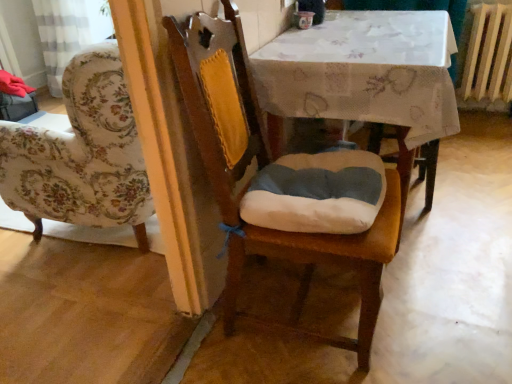
Measure the distance between wooden radiator at right and camera.

wooden radiator at right and camera are 8.00 feet apart.

The width and height of the screenshot is (512, 384). I want to click on white fabric table at center, so click(x=364, y=72).

Measure the distance between wooden radiator at right and white fabric table at center.

wooden radiator at right is 4.15 feet from white fabric table at center.

Considering the relative positions of wooden radiator at right and white fabric table at center in the image provided, is wooden radiator at right to the right of white fabric table at center from the viewer's perspective?

Yes, wooden radiator at right is to the right of white fabric table at center.

From a real-world perspective, is wooden radiator at right below white fabric table at center?

No.

How different are the orientations of wooden radiator at right and white fabric table at center in degrees?

They differ by 89.4 degrees in their facing directions.

Based on the photo, does wooden chair at center have a lesser width compared to wooden radiator at right?

In fact, wooden chair at center might be wider than wooden radiator at right.

Is wooden chair at center turned away from wooden radiator at right?

That's not correct — wooden chair at center is not looking away from wooden radiator at right.

Does wooden chair at center contain wooden radiator at right?

No, wooden radiator at right is located outside of wooden chair at center.

From the image's perspective, is wooden chair at center located above or below wooden radiator at right?

wooden chair at center is below wooden radiator at right.

From their relative heights in the image, would you say white fabric table at center is taller or shorter than wooden chair at center?

Considering their sizes, white fabric table at center has less height than wooden chair at center.

Are white fabric table at center and wooden chair at center far apart?

No.

Which object is thinner, white fabric table at center or wooden chair at center?

With smaller width is wooden chair at center.

Is white fabric table at center oriented towards wooden chair at center?

No.

Between white fabric table at center and wooden radiator at right, which one has larger width?

With larger width is white fabric table at center.

Is white fabric table at center not near wooden radiator at right?

Absolutely, white fabric table at center is distant from wooden radiator at right.

Considering the positions of points (309, 44) and (468, 74), is point (309, 44) closer to camera compared to point (468, 74)?

Yes, point (309, 44) is in front of point (468, 74).

Between white fabric table at center and wooden radiator at right, which one has more height?

With more height is white fabric table at center.

Is wooden radiator at right next to wooden chair at center?

No, wooden radiator at right is not touching wooden chair at center.

Which of these two, wooden radiator at right or wooden chair at center, is smaller?

wooden radiator at right is smaller.

Does point (484, 25) come closer to viewer compared to point (380, 224)?

No.

Which is more to the left, wooden radiator at right or wooden chair at center?

From the viewer's perspective, wooden chair at center appears more on the left side.

Between wooden chair at center and white fabric table at center, which one has less height?

With less height is white fabric table at center.

Is wooden chair at center positioned far away from white fabric table at center?

wooden chair at center is actually quite close to white fabric table at center.

Measure the distance between wooden chair at center and white fabric table at center.

15.03 inches.

Considering the relative sizes of wooden chair at center and white fabric table at center in the image provided, is wooden chair at center smaller than white fabric table at center?

Correct, wooden chair at center occupies less space than white fabric table at center.

Locate an element on the screen. This screenshot has height=384, width=512. radiator above the white fabric table at center (from the image's perspective) is located at coordinates (489, 54).

Find the location of a particular element. This screenshot has width=512, height=384. chair that appears above the wooden radiator at right (from a real-world perspective) is located at coordinates (263, 166).

Estimate the real-world distances between objects in this image. Which object is closer to wooden radiator at right, wooden chair at center or white fabric table at center?

The object closer to wooden radiator at right is white fabric table at center.

Based on their spatial positions, is wooden radiator at right or wooden chair at center closer to white fabric table at center?

wooden chair at center.

From the image, which object appears to be farther from wooden radiator at right, white fabric table at center or wooden chair at center?

wooden chair at center is positioned further to the anchor wooden radiator at right.

Considering their positions, is white fabric table at center positioned closer to wooden chair at center than wooden radiator at right?

white fabric table at center is closer to wooden chair at center.

Which object lies further to the anchor point white fabric table at center, wooden chair at center or wooden radiator at right?

wooden radiator at right is positioned further to the anchor white fabric table at center.

Which object lies nearer to the anchor point wooden chair at center, wooden radiator at right or white fabric table at center?

The object closer to wooden chair at center is white fabric table at center.

What are the coordinates of `table positioned between wooden chair at center and wooden radiator at right from near to far` in the screenshot? It's located at (364, 72).